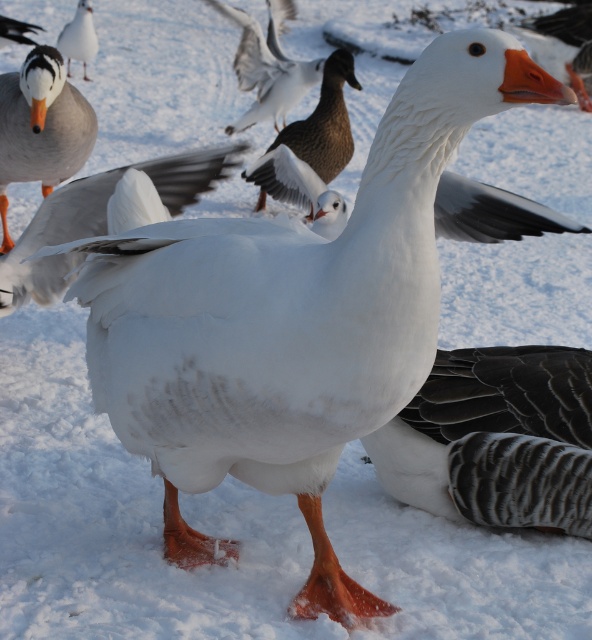
Question: Which point appears closest to the camera in this image?

Choices:
 (A) (554, 67)
 (B) (342, 106)
 (C) (70, 44)

Answer: (B)

Question: Which object appears farthest from the camera in this image?

Choices:
 (A) brown matte duck at center
 (B) orange beak at center
 (C) white feathered duck at left

Answer: (B)

Question: Does dark gray textured wing at lower right have a larger size compared to orange beak at center?

Choices:
 (A) yes
 (B) no

Answer: (B)

Question: In this image, where is dark gray textured wing at lower right located relative to brown matte duck at center?

Choices:
 (A) right
 (B) left

Answer: (A)

Question: Among these points, which one is farthest from the camera?

Choices:
 (A) (562, 17)
 (B) (336, 64)
 (C) (91, 36)

Answer: (A)

Question: Considering the relative positions of dark gray textured wing at lower right and orange beak at center in the image provided, where is dark gray textured wing at lower right located with respect to orange beak at center?

Choices:
 (A) below
 (B) above

Answer: (A)